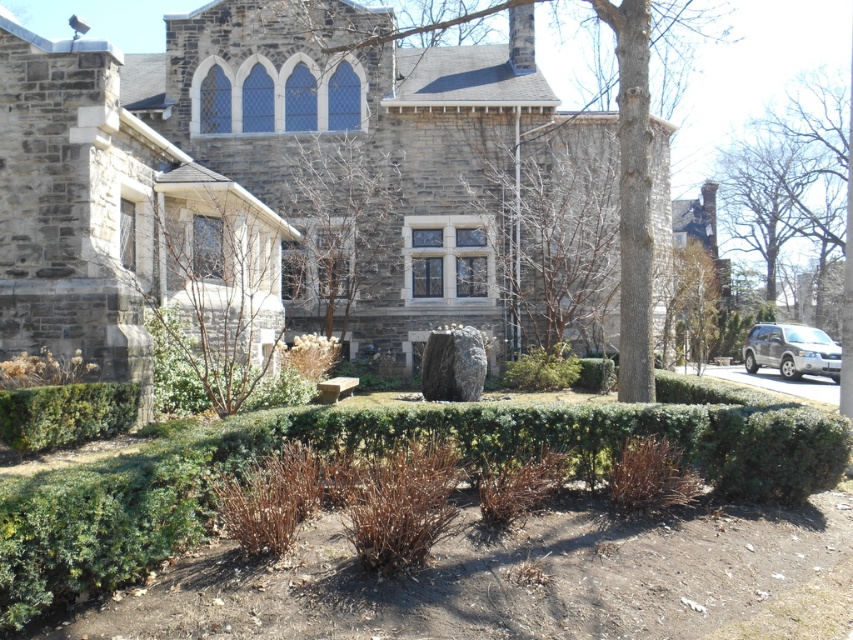
Question: Is smooth gray stone tree at center to the left of green leafy hedge at lower left from the viewer's perspective?

Choices:
 (A) yes
 (B) no

Answer: (B)

Question: Does brown textured tree at center appear on the right side of silver metallic suv at right?

Choices:
 (A) no
 (B) yes

Answer: (A)

Question: Which point appears farthest from the camera in this image?

Choices:
 (A) (120, 397)
 (B) (625, 6)
 (C) (494, 147)

Answer: (C)

Question: Which object appears closest to the camera in this image?

Choices:
 (A) green leafy bush at center
 (B) silver metallic suv at right
 (C) brown textured tree at center

Answer: (A)

Question: Is bare branches at center to the left of bare wood tree at center from the viewer's perspective?

Choices:
 (A) yes
 (B) no

Answer: (A)

Question: Which of the following is the closest to the observer?

Choices:
 (A) (262, 204)
 (B) (73, 467)
 (C) (297, 282)

Answer: (B)